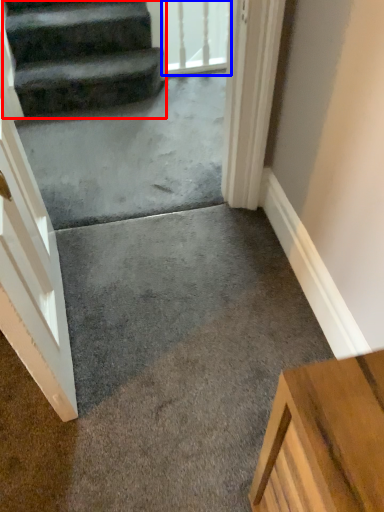
Question: Which object is further to the camera taking this photo, stairs (highlighted by a red box) or glass door (highlighted by a blue box)?

Choices:
 (A) stairs
 (B) glass door

Answer: (B)